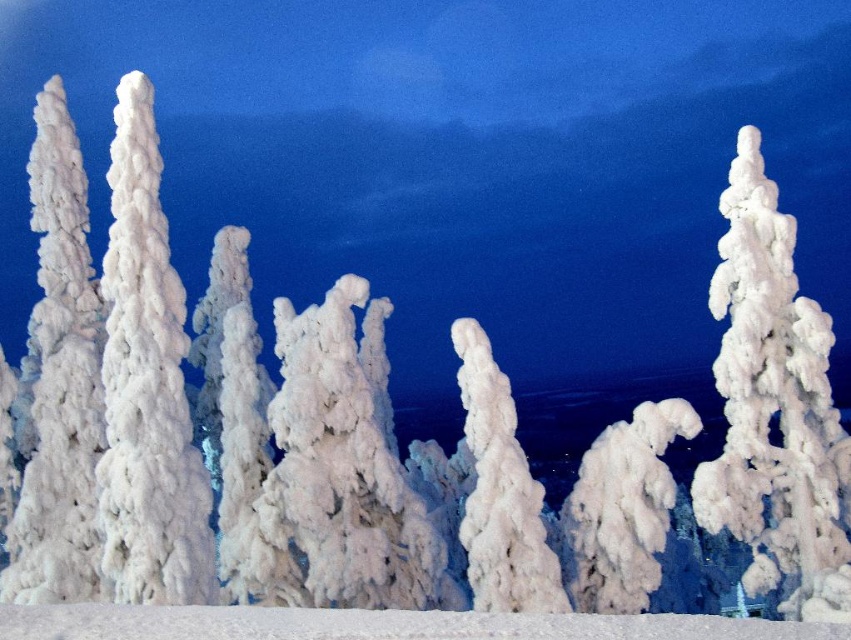
You are a photographer standing at the edge of the snowy landscape. You want to capture a photo that includes both the white fluffy snow at center and the frosted white tree at center. Given that your camera has a maximum focus range of 20 feet, will you be able to get both objects in focus simultaneously?

The white fluffy snow at center and the frosted white tree at center are 21.51 feet apart. Since the camera can only focus within 20 feet, the distance between them exceeds the maximum focus range. Therefore, you cannot get both objects in focus at the same time.